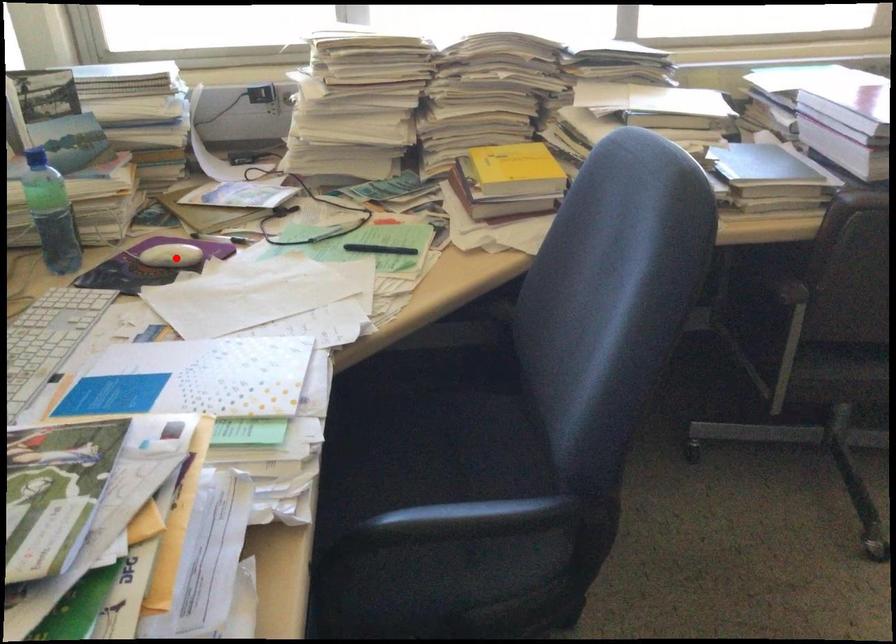
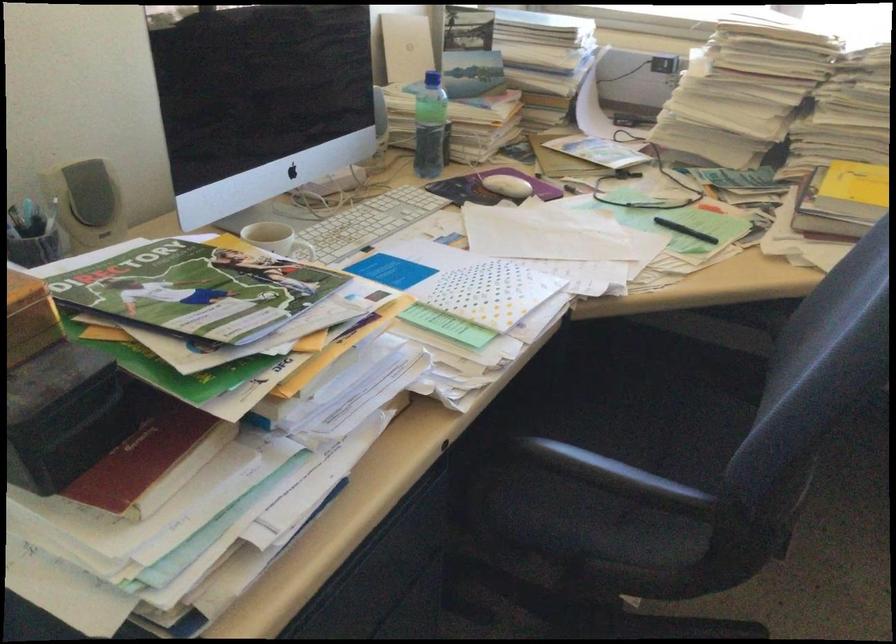
Question: I am providing you with two images of the same scene from different viewpoints. Image1 has a red point marked. In image2, the corresponding 3D location appears at what relative position? Reply with the corresponding letter.

Choices:
 (A) Closer
 (B) Farther

Answer: (B)